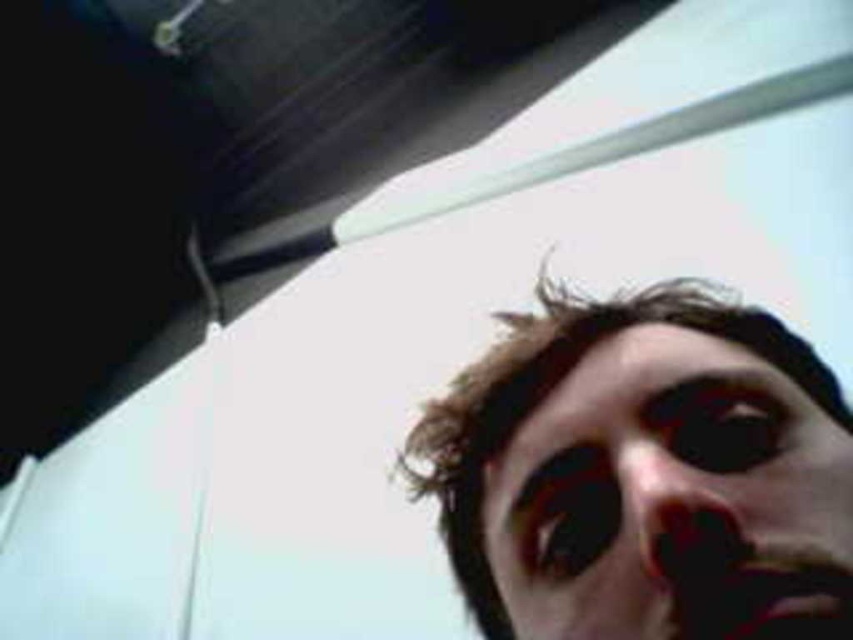
Consider the image. You are a photographer trying to capture a closeup shot of the smooth skin face at bottom right and the smooth skin nose at center. Which object should you focus on first if you want to ensure both are in focus?

The smooth skin face at bottom right is located below the smooth skin nose at center. To ensure both are in focus, you should focus on the smooth skin nose at center first since it is closer to the camera.

You are a photographer trying to capture a portrait of the person in the car. You notice the smooth skin face at bottom right and the smooth skin nose at center. Which of these two objects is larger in size?

The smooth skin face at bottom right is bigger than the smooth skin nose at center.